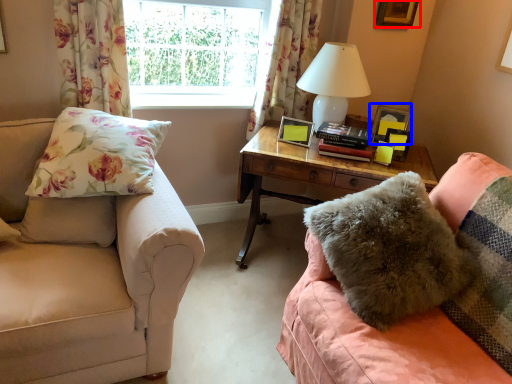
Question: Which of the following is the farthest to the observer, picture frame (highlighted by a red box) or picture frame (highlighted by a blue box)?

Choices:
 (A) picture frame
 (B) picture frame

Answer: (A)